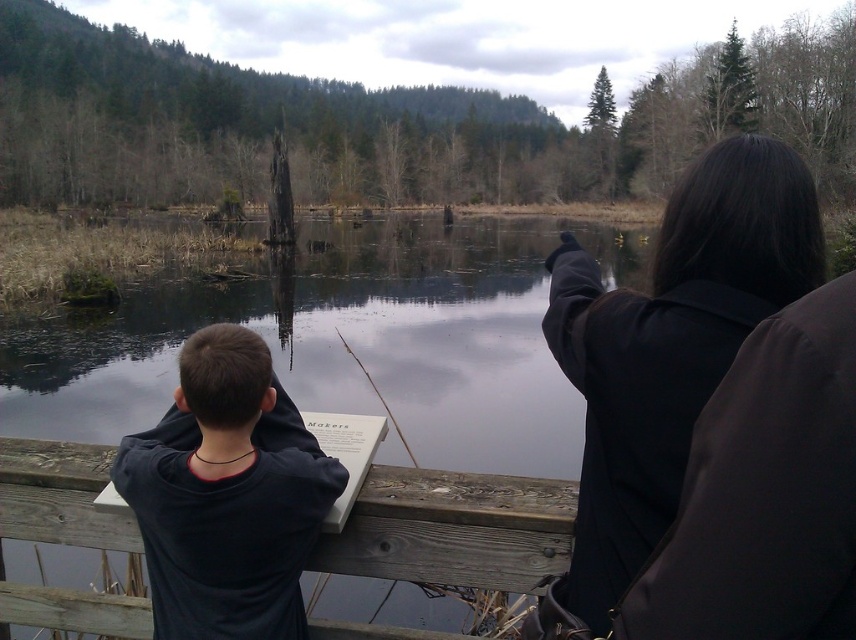
You are standing in the forest scene and want to hand a map to the adult wearing the black matte coat at upper right. To do this, should you move to the left or the right of the dark blue shirt at center?

The black matte coat at upper right is to the right of the dark blue shirt at center, so you should move to the right of the dark blue shirt at center to hand the map to the adult wearing the black matte coat at upper right.

You are standing at the center of the wooden railing in the foreground. You want to walk towards the dark blue shirt at center. Which direction should you walk?

You should walk towards the direction of the dark blue shirt at center, which is located at point 0.775 on the x axis and 0.266 on the y axis.